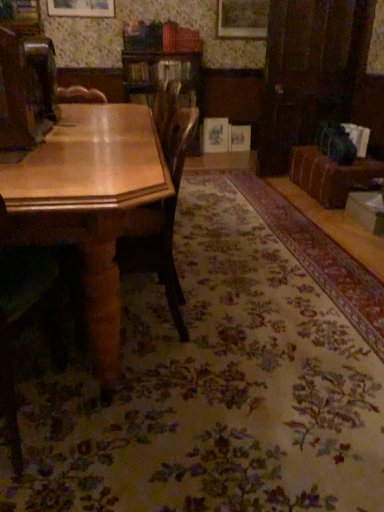
Question: Does wooden chair at center, which is the second chair from left to right, have a smaller size compared to wooden chair at left, the 2th chair in the right-to-left sequence?

Choices:
 (A) yes
 (B) no

Answer: (B)

Question: Is the depth of wooden chair at center, marked as the 1th chair in a right-to-left arrangement, greater than that of wooden chair at left, acting as the 1th chair starting from the left?

Choices:
 (A) yes
 (B) no

Answer: (A)

Question: Is wooden chair at center, which is the second chair from left to right, not within wooden chair at left, the 2th chair in the right-to-left sequence?

Choices:
 (A) yes
 (B) no

Answer: (A)

Question: Can you confirm if wooden chair at center, marked as the 1th chair in a right-to-left arrangement, is shorter than wooden chair at left, the 2th chair in the right-to-left sequence?

Choices:
 (A) no
 (B) yes

Answer: (B)

Question: Can you confirm if wooden chair at center, which is the second chair from left to right, is bigger than wooden chair at left, acting as the 1th chair starting from the left?

Choices:
 (A) yes
 (B) no

Answer: (A)

Question: From the image's perspective, does wooden chair at center, which is the second chair from left to right, appear lower than wooden chair at left, acting as the 1th chair starting from the left?

Choices:
 (A) no
 (B) yes

Answer: (A)

Question: Could you tell me if velvet brown couch at right is turned towards wooden table at left?

Choices:
 (A) no
 (B) yes

Answer: (B)

Question: Considering the relative positions of velvet brown couch at right and wooden table at left in the image provided, is velvet brown couch at right to the left of wooden table at left from the viewer's perspective?

Choices:
 (A) no
 (B) yes

Answer: (A)

Question: Can you confirm if velvet brown couch at right is smaller than wooden table at left?

Choices:
 (A) no
 (B) yes

Answer: (B)

Question: Does velvet brown couch at right have a lesser height compared to wooden table at left?

Choices:
 (A) no
 (B) yes

Answer: (B)

Question: Is velvet brown couch at right wider than wooden table at left?

Choices:
 (A) yes
 (B) no

Answer: (B)

Question: From the image's perspective, is velvet brown couch at right on top of wooden table at left?

Choices:
 (A) no
 (B) yes

Answer: (B)

Question: Is velvet brown couch at right completely or partially outside of wooden chair at left, the 2th chair in the right-to-left sequence?

Choices:
 (A) yes
 (B) no

Answer: (A)